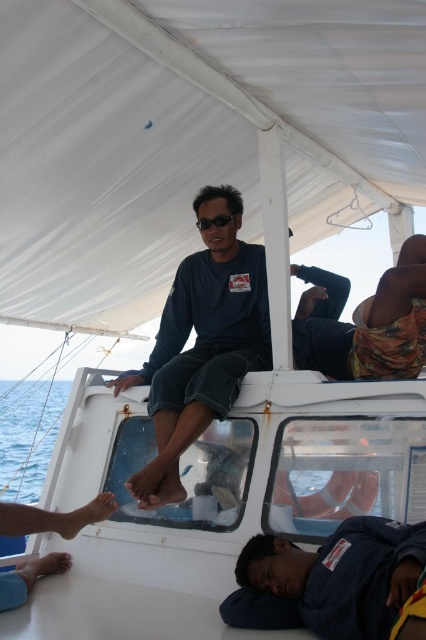
Question: Among these objects, which one is nearest to the camera?

Choices:
 (A) dark blue fabric at lower right
 (B) matte blue shirt at center
 (C) blue water at lower left
 (D) black plastic goggles at upper center

Answer: (A)

Question: In this image, where is transparent blue water at lower left located relative to blue water at lower left?

Choices:
 (A) above
 (B) below

Answer: (A)

Question: Can you confirm if blue water at lower left is thinner than black plastic goggles at upper center?

Choices:
 (A) yes
 (B) no

Answer: (B)

Question: Which point appears closest to the camera in this image?

Choices:
 (A) coord(13,480)
 (B) coord(224,372)
 (C) coord(316,531)
 (D) coord(219,220)

Answer: (C)

Question: Which point is farther from the camera taking this photo?

Choices:
 (A) (396, 365)
 (B) (89, 380)
 (C) (226, 221)

Answer: (B)

Question: Is transparent blue water at lower left above black plastic goggles at upper center?

Choices:
 (A) yes
 (B) no

Answer: (B)